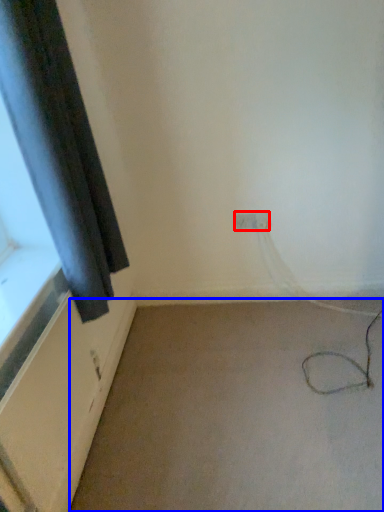
Question: Which object is closer to the camera taking this photo, electric outlet (highlighted by a red box) or plain (highlighted by a blue box)?

Choices:
 (A) electric outlet
 (B) plain

Answer: (B)